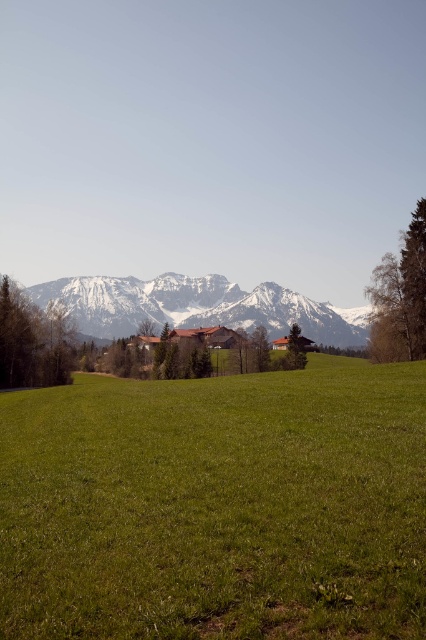
Question: Among these objects, which one is farthest from the camera?

Choices:
 (A) snowy rock mountain range at center
 (B) green grassy pasture at center

Answer: (A)

Question: Is green grassy pasture at center behind snowy rock mountain range at center?

Choices:
 (A) yes
 (B) no

Answer: (B)

Question: Is green grassy pasture at center bigger than snowy rock mountain range at center?

Choices:
 (A) no
 (B) yes

Answer: (A)

Question: Can you confirm if green grassy pasture at center is thinner than snowy rock mountain range at center?

Choices:
 (A) yes
 (B) no

Answer: (A)